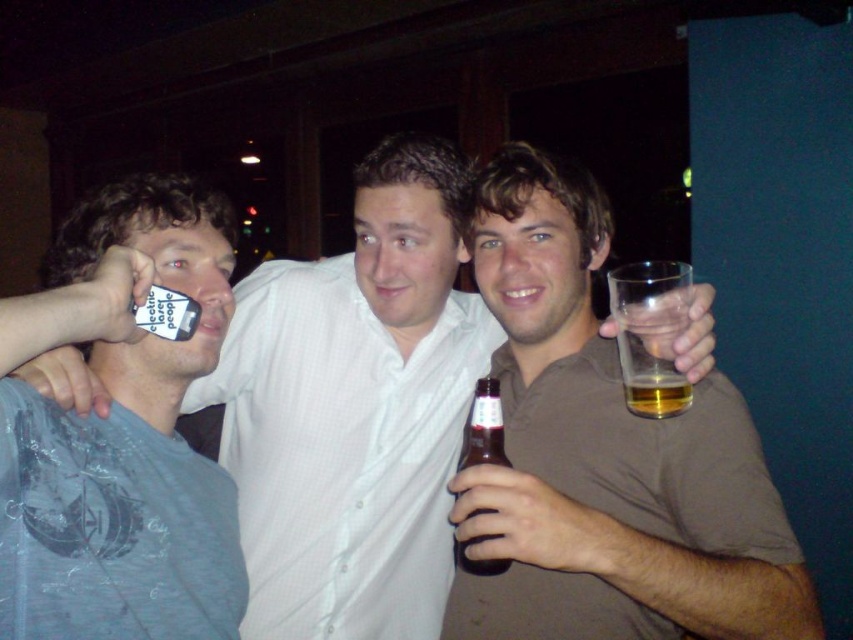
Question: Which is nearer to the gray cotton t-shirt at left?

Choices:
 (A) brown glass bottle at center
 (B) matte white shirt at center
 (C) brown matte glass at right

Answer: (A)

Question: Is gray cotton t-shirt at left to the left of brown glass bottle at center from the viewer's perspective?

Choices:
 (A) no
 (B) yes

Answer: (B)

Question: Which object appears farthest from the camera in this image?

Choices:
 (A) brown glass bottle at center
 (B) gray cotton t-shirt at left
 (C) brown matte glass at right
 (D) translucent glass beer at right

Answer: (D)

Question: Where is matte white shirt at center located in relation to gray cotton t-shirt at left in the image?

Choices:
 (A) below
 (B) above

Answer: (A)

Question: From the image, what is the correct spatial relationship of translucent glass at right in relation to translucent glass beer at right?

Choices:
 (A) above
 (B) below

Answer: (A)

Question: Which point appears farthest from the camera in this image?

Choices:
 (A) (503, 442)
 (B) (639, 316)
 (C) (619, 616)
 (D) (177, 502)

Answer: (A)